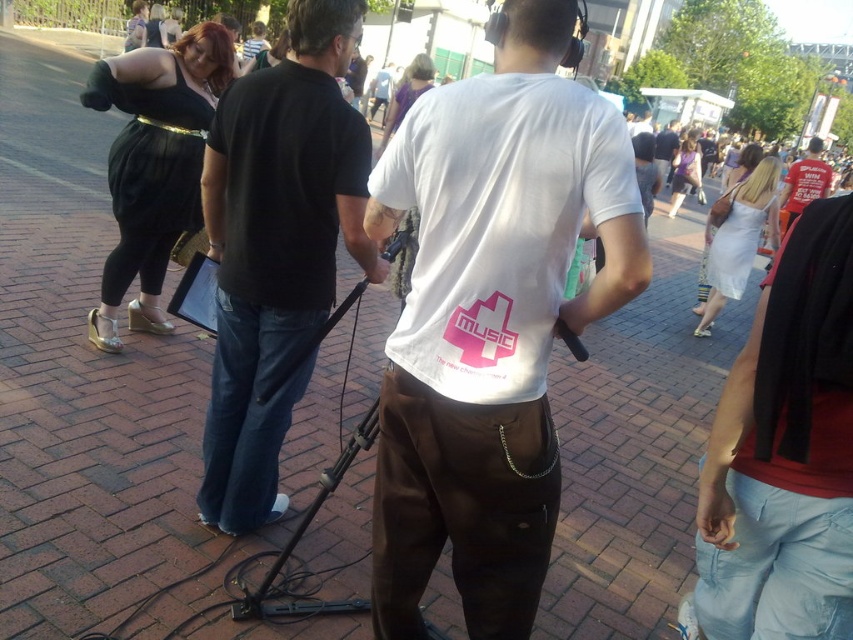
You are organizing a costume party and need to ensure all outfits meet the dress code requirement of having a minimum length of 30 cm. You see two outfits in the image, the black satin dress at upper left and the red matte shirt at upper right. Which of these outfits would comply with the dress code based on their lengths?

The red matte shirt at upper right would comply with the dress code since it is longer than the black satin dress at upper left, which is below the required 30 cm minimum length.

You are at an outdoor event and see two people wearing the black satin dress at upper left and the red matte shirt at upper right. Which one is more to the left?

The black satin dress at upper left is more to the left side of the red matte shirt at upper right.